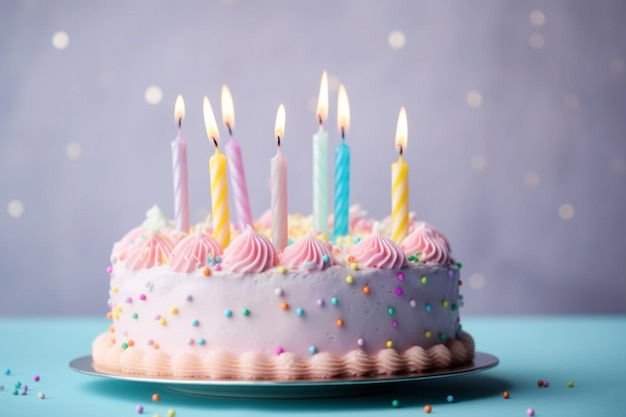
The height and width of the screenshot is (417, 626). I want to click on candle wicks, so click(x=181, y=124), click(x=213, y=141), click(x=230, y=128), click(x=279, y=138), click(x=322, y=119), click(x=342, y=132), click(x=399, y=150).